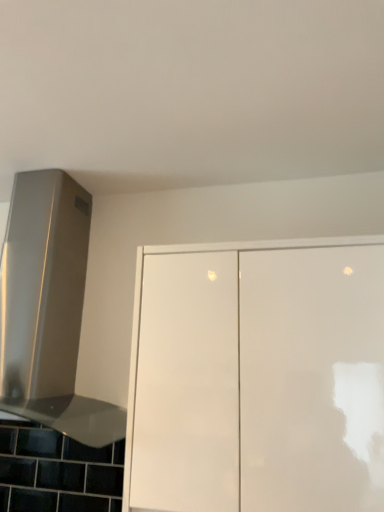
Question: From the image's perspective, is satin silver vent at upper left above or below white glossy cabinet at center?

Choices:
 (A) above
 (B) below

Answer: (A)

Question: From a real-world perspective, is satin silver vent at upper left positioned above or below white glossy cabinet at center?

Choices:
 (A) below
 (B) above

Answer: (B)

Question: Considering the positions of point (44, 254) and point (160, 448), is point (44, 254) closer or farther from the camera than point (160, 448)?

Choices:
 (A) farther
 (B) closer

Answer: (A)

Question: Looking at the image, does white glossy cabinet at center seem bigger or smaller compared to satin silver vent at upper left?

Choices:
 (A) big
 (B) small

Answer: (B)

Question: Is white glossy cabinet at center to the left or to the right of satin silver vent at upper left in the image?

Choices:
 (A) right
 (B) left

Answer: (A)

Question: From the image's perspective, is white glossy cabinet at center above or below satin silver vent at upper left?

Choices:
 (A) above
 (B) below

Answer: (B)

Question: Considering the positions of white glossy cabinet at center and satin silver vent at upper left in the image, is white glossy cabinet at center wider or thinner than satin silver vent at upper left?

Choices:
 (A) thin
 (B) wide

Answer: (A)